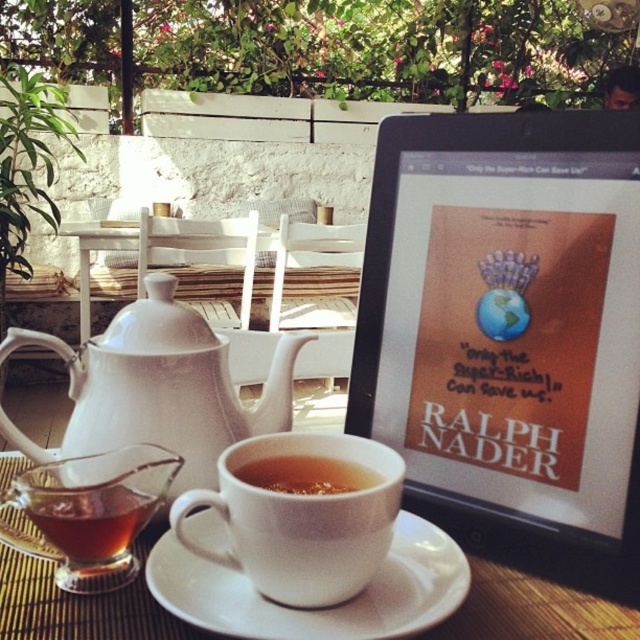
You are a customer at the outdoor cafe and want to choose the wider cup for your tea. Which one should you pick between the transparent glass teacup at lower left and the translucent glass cup at lower left?

The transparent glass teacup at lower left is wider than the translucent glass cup at lower left, so you should pick the transparent glass teacup at lower left.

Based on the photo, you are a customer at the outdoor table and want to reach for your drink. Which item should you grab first if you need to pick up the white ceramic cup at center before the white ceramic saucer at center?

You should grab the white ceramic cup at center first because it is positioned to the left of the white ceramic saucer at center, making it easier to access without moving the saucer first.

You are standing at the entrance of the outdoor area and want to walk towards the bench. There are two points marked on the path. Which point should you step on first, point (90, 589) or point (132, 490)?

You should step on point (132, 490) first because point (90, 589) is behind it.